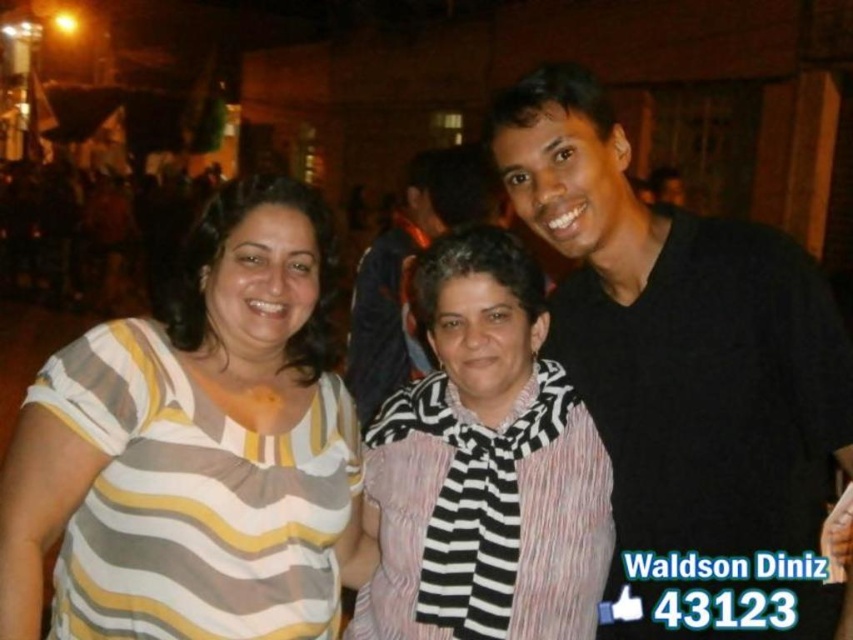
Question: Which of the following is the farthest from the observer?

Choices:
 (A) (825, 440)
 (B) (393, 627)

Answer: (B)

Question: Which point is farther to the camera?

Choices:
 (A) click(x=627, y=630)
 (B) click(x=459, y=593)
 (C) click(x=378, y=403)

Answer: (C)

Question: Can you confirm if striped fabric shirt at center is bigger than black matte shirt at center?

Choices:
 (A) no
 (B) yes

Answer: (A)

Question: Can you confirm if striped fabric scarf at center is positioned above black matte shirt at center?

Choices:
 (A) yes
 (B) no

Answer: (B)

Question: Does black matte shirt at right appear over striped fabric shirt at center?

Choices:
 (A) yes
 (B) no

Answer: (A)

Question: Among these objects, which one is farthest from the camera?

Choices:
 (A) black matte shirt at right
 (B) striped fabric scarf at center
 (C) striped fabric shirt at center
 (D) black matte shirt at center

Answer: (D)